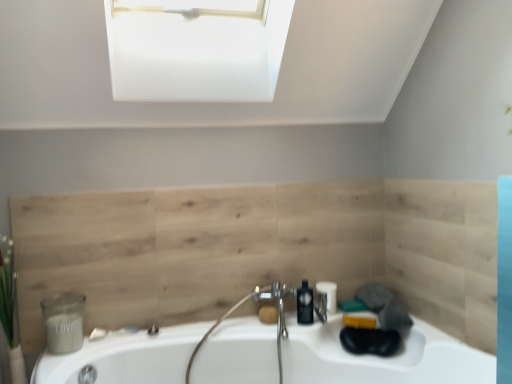
Question: Does white glossy bathtub at center have a greater width compared to natural wood paneling at center?

Choices:
 (A) yes
 (B) no

Answer: (A)

Question: Is white glossy bathtub at center at the left side of natural wood paneling at center?

Choices:
 (A) yes
 (B) no

Answer: (B)

Question: From the image's perspective, is white glossy bathtub at center on natural wood paneling at center?

Choices:
 (A) yes
 (B) no

Answer: (B)

Question: Can you confirm if white glossy bathtub at center is shorter than natural wood paneling at center?

Choices:
 (A) no
 (B) yes

Answer: (B)

Question: Is white glossy bathtub at center not inside natural wood paneling at center?

Choices:
 (A) yes
 (B) no

Answer: (A)

Question: Does white glossy bathtub at center have a greater height compared to natural wood paneling at center?

Choices:
 (A) no
 (B) yes

Answer: (A)

Question: From the image's perspective, is natural wood paneling at center below black plastic soap dispenser at center?

Choices:
 (A) yes
 (B) no

Answer: (B)

Question: Does natural wood paneling at center turn towards black plastic soap dispenser at center?

Choices:
 (A) no
 (B) yes

Answer: (B)

Question: Does natural wood paneling at center lie in front of black plastic soap dispenser at center?

Choices:
 (A) yes
 (B) no

Answer: (A)

Question: Is natural wood paneling at center to the right of black plastic soap dispenser at center from the viewer's perspective?

Choices:
 (A) yes
 (B) no

Answer: (B)

Question: From a real-world perspective, is natural wood paneling at center below black plastic soap dispenser at center?

Choices:
 (A) yes
 (B) no

Answer: (B)

Question: Is natural wood paneling at center positioned with its back to black plastic soap dispenser at center?

Choices:
 (A) yes
 (B) no

Answer: (A)

Question: Considering the relative sizes of natural wood paneling at center and green leafy plant at left in the image provided, is natural wood paneling at center thinner than green leafy plant at left?

Choices:
 (A) yes
 (B) no

Answer: (A)